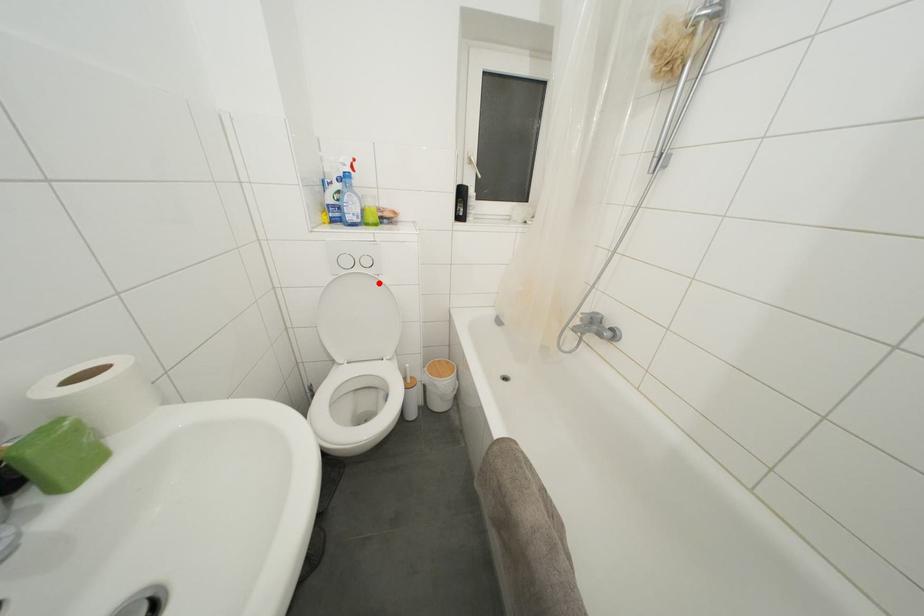
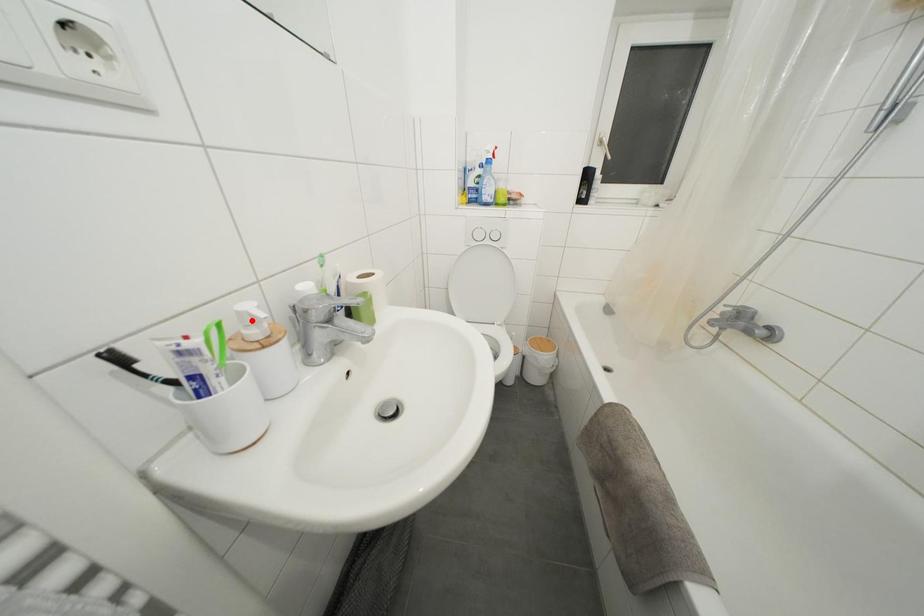
I am providing you with two images of the same scene from different viewpoints. A red point is marked on the first image and another point is marked on the second image. Does the point marked in image1 correspond to the same location as the one in image2?

No